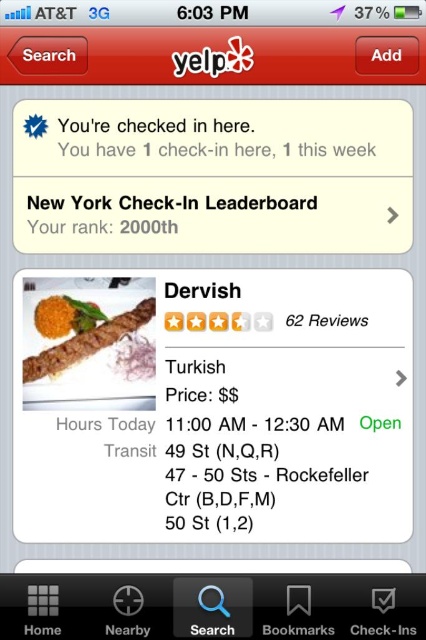
Question: Does brown matte kebab at center lie behind orange matte curry at center?

Choices:
 (A) no
 (B) yes

Answer: (A)

Question: Which object is farther from the camera taking this photo?

Choices:
 (A) orange matte curry at center
 (B) brown matte kebab at center

Answer: (A)

Question: Can you confirm if brown matte kebab at center is thinner than orange matte curry at center?

Choices:
 (A) no
 (B) yes

Answer: (A)

Question: Is brown matte kebab at center to the right of orange matte curry at center from the viewer's perspective?

Choices:
 (A) no
 (B) yes

Answer: (B)

Question: Which point is farther to the camera?

Choices:
 (A) brown matte kebab at center
 (B) orange matte curry at center

Answer: (B)

Question: Which point is closer to the camera?

Choices:
 (A) orange matte curry at center
 (B) brown matte kebab at center

Answer: (B)